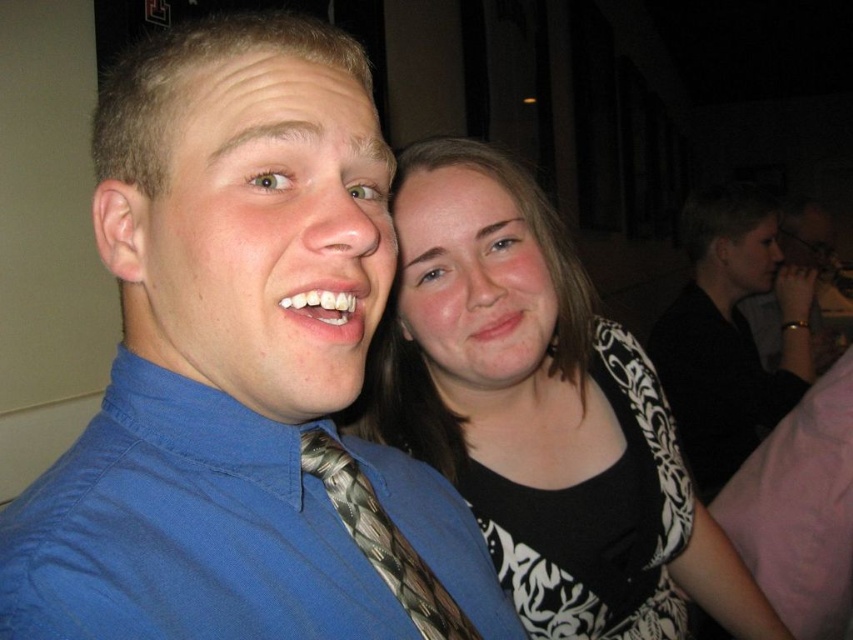
Question: Where is black matte shirt at right located in relation to matte black hair at upper right in the image?

Choices:
 (A) right
 (B) left

Answer: (B)

Question: Which object is closer to the camera taking this photo?

Choices:
 (A) black and white patterned dress at upper right
 (B) blue textured shirt at left

Answer: (B)

Question: Does blue textured shirt at left lie in front of blue cotton shirt at center?

Choices:
 (A) yes
 (B) no

Answer: (A)

Question: Which point is farther to the camera?

Choices:
 (A) (450, 291)
 (B) (404, 157)
 (C) (389, 534)

Answer: (B)

Question: Which object appears closest to the camera in this image?

Choices:
 (A) silvery metallic tie at center
 (B) black matte shirt at right
 (C) matte black hair at upper right

Answer: (A)

Question: Can you confirm if blue fabric face at center is bigger than black matte shirt at right?

Choices:
 (A) no
 (B) yes

Answer: (A)